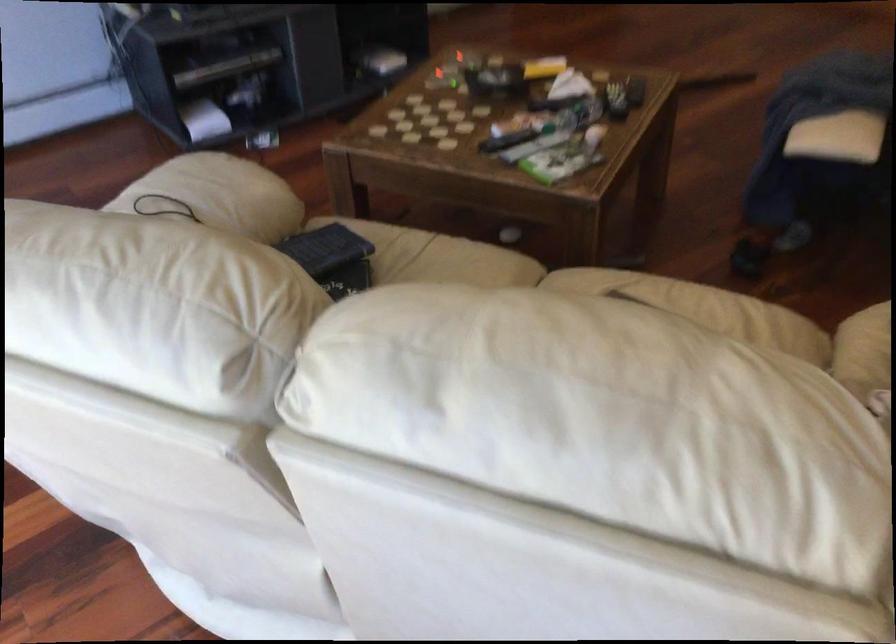
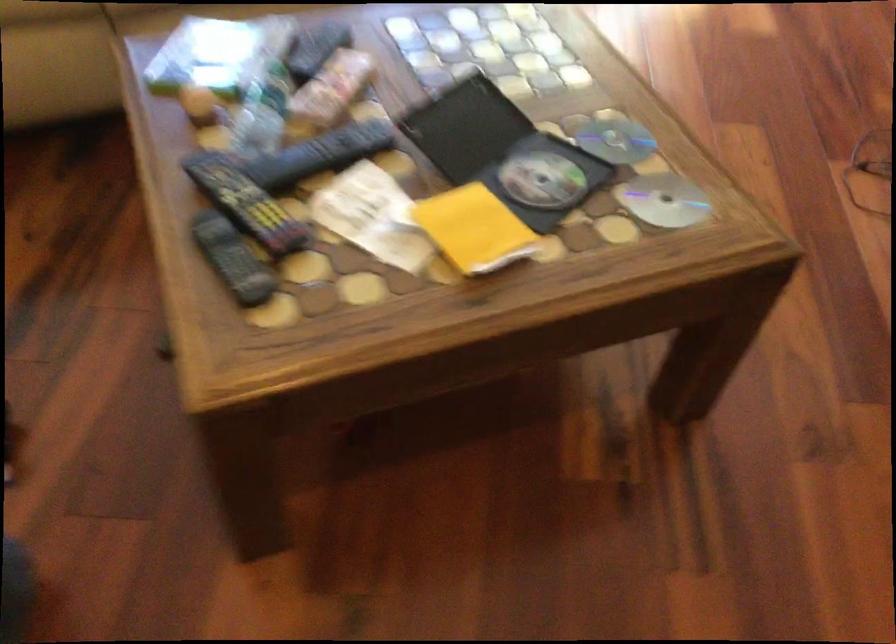
The point at (492, 84) is marked in the first image. Where is the corresponding point in the second image?

(503, 152)